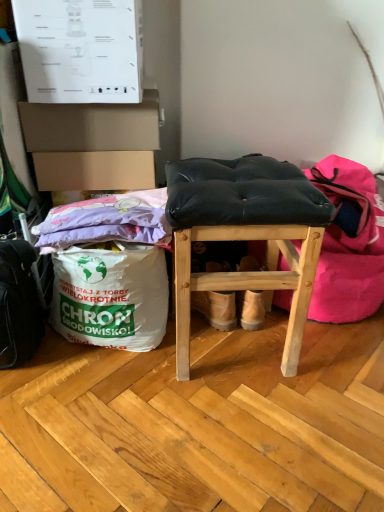
Question: Is black fabric bean bag chair at center in front of or behind black leather stool at center in the image?

Choices:
 (A) front
 (B) behind

Answer: (B)

Question: Choose the correct answer: Is black fabric bean bag chair at center inside black leather stool at center or outside it?

Choices:
 (A) outside
 (B) inside

Answer: (A)

Question: Estimate the real-world distances between objects in this image. Which object is farther from the black leather stool at center?

Choices:
 (A) cardboard box at upper left
 (B) black leather messenger bag at lower left
 (C) white paper grocery bag at lower left
 (D) purple fabric at left
 (E) black fabric bean bag chair at center

Answer: (B)

Question: Which object is positioned farthest from the black fabric bean bag chair at center?

Choices:
 (A) black leather stool at center
 (B) purple fabric at left
 (C) white paper grocery bag at lower left
 (D) cardboard box at upper left
 (E) black leather messenger bag at lower left

Answer: (E)